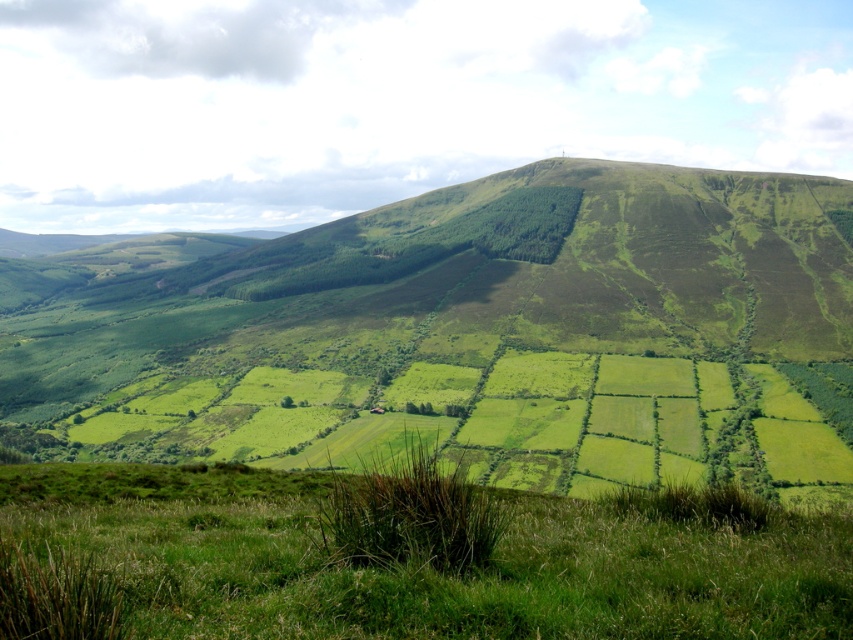
Question: Which of the following is the farthest from the observer?

Choices:
 (A) green grassy hill at center
 (B) green grassy at lower center

Answer: (A)

Question: Is green grassy hill at center thinner than green grassy at lower center?

Choices:
 (A) yes
 (B) no

Answer: (B)

Question: Is green grassy hill at center above green grassy at lower center?

Choices:
 (A) no
 (B) yes

Answer: (B)

Question: Is green grassy hill at center thinner than green grassy at lower center?

Choices:
 (A) yes
 (B) no

Answer: (B)